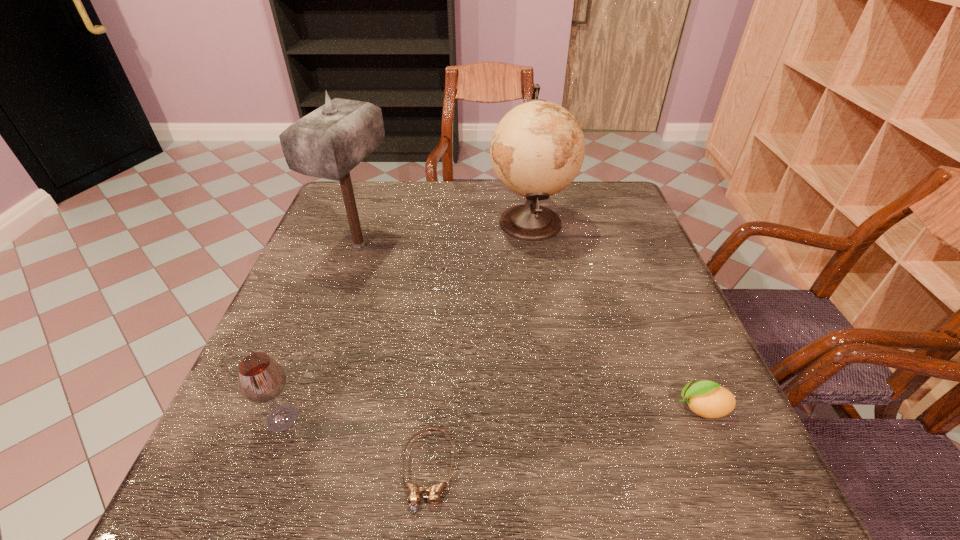
I want to click on wineglass situated at the left edge, so click(262, 379).

Where is `object at the right edge`? object at the right edge is located at coordinates (708, 399).

In order to click on object that is at the far left corner in this screenshot , I will do `click(329, 142)`.

The image size is (960, 540). In the image, there is a desktop. Identify the location of blank space at the far edge. (459, 180).

The image size is (960, 540). I want to click on vacant point at the near edge, so click(x=556, y=483).

Where is `vacant space at the left edge`? The width and height of the screenshot is (960, 540). vacant space at the left edge is located at coordinates (342, 261).

At what (x,y) coordinates should I click in order to perform the action: click on vacant space at the right edge of the desktop. Please return your answer as a coordinate pair (x, y). The height and width of the screenshot is (540, 960). Looking at the image, I should click on (634, 245).

In the image, there is a desktop. In order to click on vacant area at the far left corner in this screenshot , I will do `click(331, 222)`.

Where is `free space at the near left corner of the desktop`? free space at the near left corner of the desktop is located at coordinates (260, 461).

You are a GUI agent. You are given a task and a screenshot of the screen. Output one action in this format:
    pyautogui.click(x=<x>, y=<y>)
    Task: Click on the vacant position at the far right corner of the desktop
    
    Given the screenshot: What is the action you would take?
    pyautogui.click(x=586, y=182)